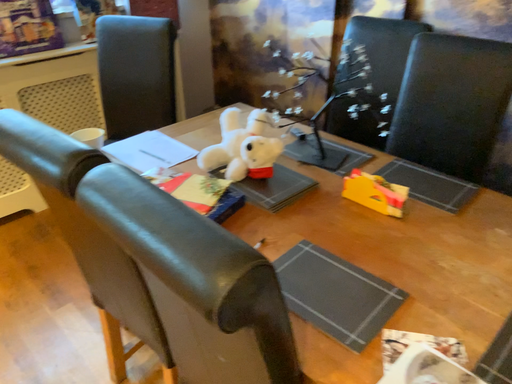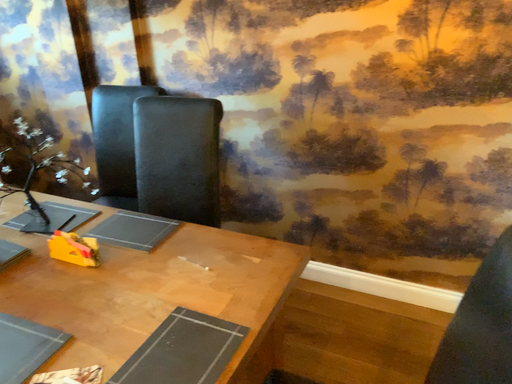
Question: How did the camera likely rotate when shooting the video?

Choices:
 (A) rotated right
 (B) rotated left

Answer: (A)